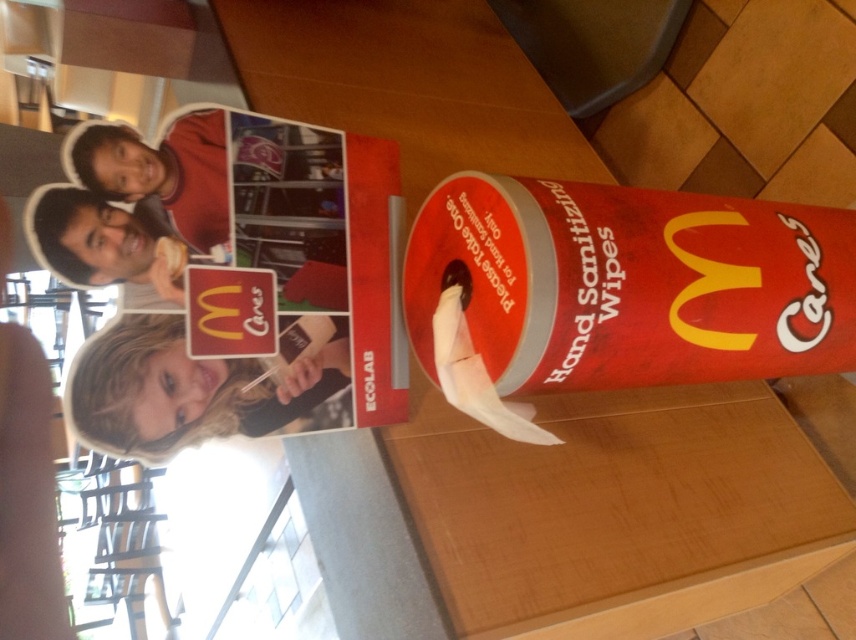
Does matte red shirt at upper left have a lesser width compared to white matte toilet paper at center?

Indeed, matte red shirt at upper left has a lesser width compared to white matte toilet paper at center.

Which is below, matte red shirt at upper left or white matte toilet paper at center?

white matte toilet paper at center is below.

Locate an element on the screen. The image size is (856, 640). matte red shirt at upper left is located at coordinates (163, 172).

Can you confirm if blonde hair at center is positioned below white matte toilet paper at center?

Indeed, blonde hair at center is positioned under white matte toilet paper at center.

Does point (199, 365) lie behind point (444, 387)?

No, (199, 365) is in front of (444, 387).

You are a GUI agent. You are given a task and a screenshot of the screen. Output one action in this format:
    pyautogui.click(x=<x>, y=<y>)
    Task: Click on the blonde hair at center
    The image size is (856, 640).
    Given the screenshot: What is the action you would take?
    pyautogui.click(x=191, y=390)

Based on the photo, is blonde hair at center shorter than matte red shirt at upper left?

Indeed, blonde hair at center has a lesser height compared to matte red shirt at upper left.

Does point (206, 419) lie in front of point (88, 177)?

No, it is not.

Is point (331, 406) positioned after point (207, 148)?

Yes, it is behind point (207, 148).

Image resolution: width=856 pixels, height=640 pixels. Identify the location of blonde hair at center. (191, 390).